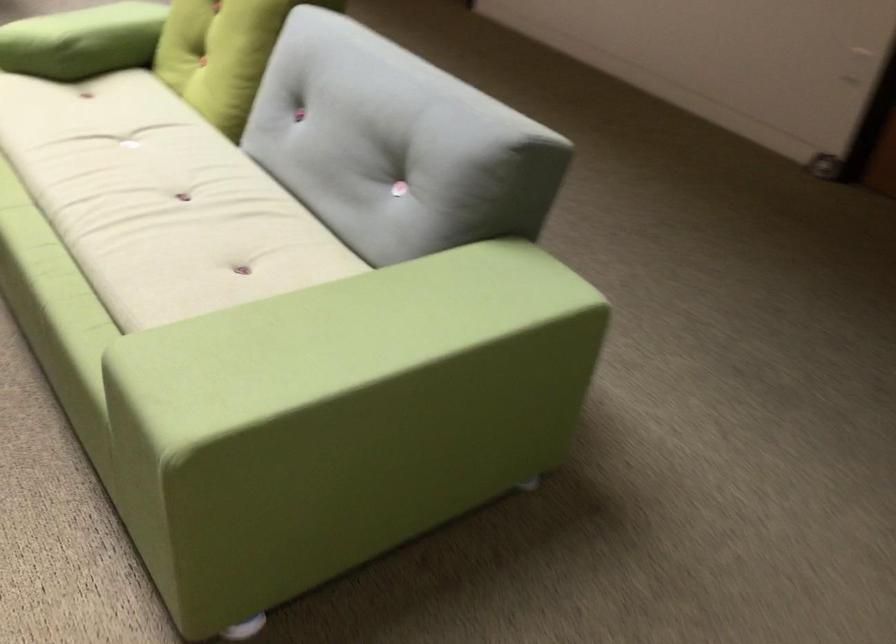
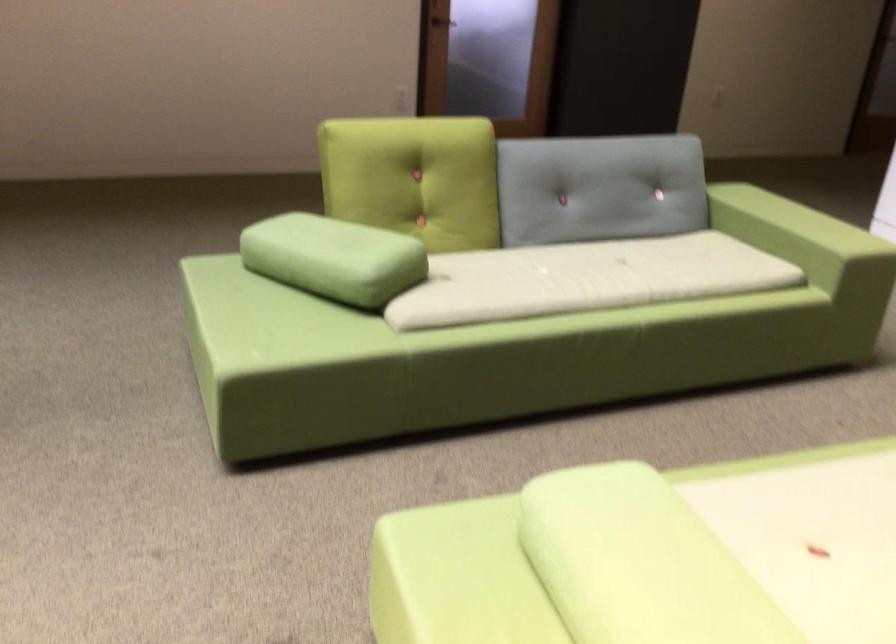
In the second image, find the point that corresponds to (x=343, y=129) in the first image.

(599, 187)